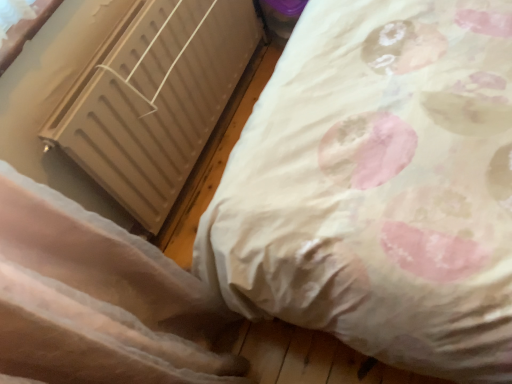
In order to face matte beige radiator at left, should I rotate leftwards or rightwards?

You should look left and rotate roughly 10.902 degrees.

What do you see at coordinates (155, 99) in the screenshot? This screenshot has height=384, width=512. I see `matte beige radiator at left` at bounding box center [155, 99].

In order to click on matte beige radiator at left in this screenshot , I will do `click(155, 99)`.

At what (x,y) coordinates should I click in order to perform the action: click on matte beige radiator at left. Please return your answer as a coordinate pair (x, y). The height and width of the screenshot is (384, 512). Looking at the image, I should click on click(155, 99).